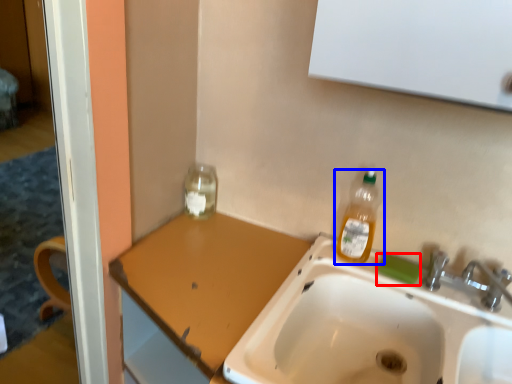
Question: Which of the following is the closest to the observer, soap (highlighted by a red box) or bottle (highlighted by a blue box)?

Choices:
 (A) soap
 (B) bottle

Answer: (B)